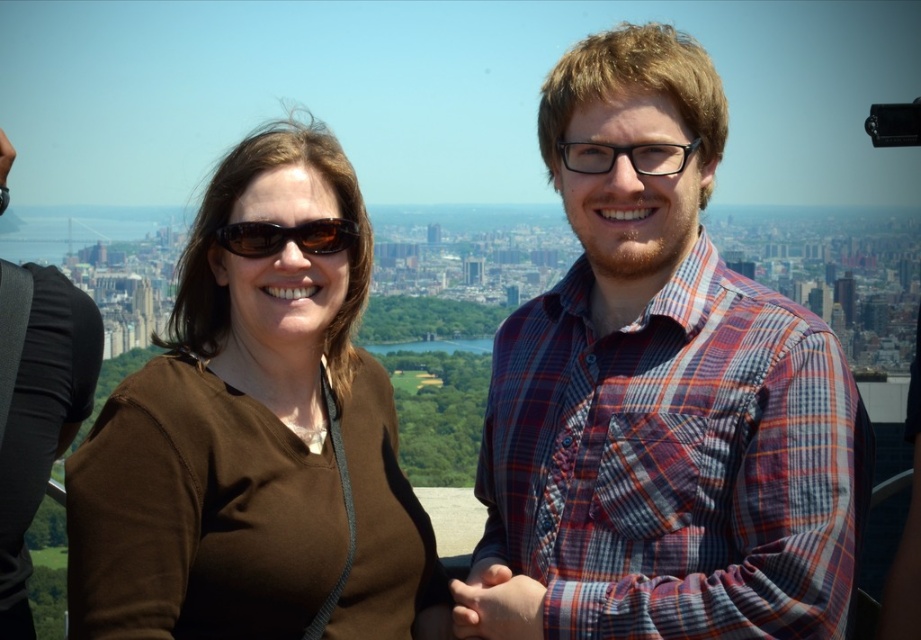
Question: Considering the relative positions of plaid shirt at center and matte brown sunglasses at center in the image provided, where is plaid shirt at center located with respect to matte brown sunglasses at center?

Choices:
 (A) left
 (B) right

Answer: (B)

Question: Which of the following is the closest to the observer?

Choices:
 (A) (185, 387)
 (B) (520, 445)

Answer: (A)

Question: From the image, what is the correct spatial relationship of plaid shirt at center in relation to brown matte shirt at center?

Choices:
 (A) below
 (B) above

Answer: (B)

Question: Among these objects, which one is nearest to the camera?

Choices:
 (A) matte brown sunglasses at center
 (B) plaid shirt at center

Answer: (B)

Question: Can you confirm if brown matte shirt at center is positioned to the left of matte brown sunglasses at center?

Choices:
 (A) no
 (B) yes

Answer: (B)

Question: Estimate the real-world distances between objects in this image. Which object is closer to the plaid shirt at center?

Choices:
 (A) matte brown sunglasses at center
 (B) brown matte shirt at center

Answer: (B)